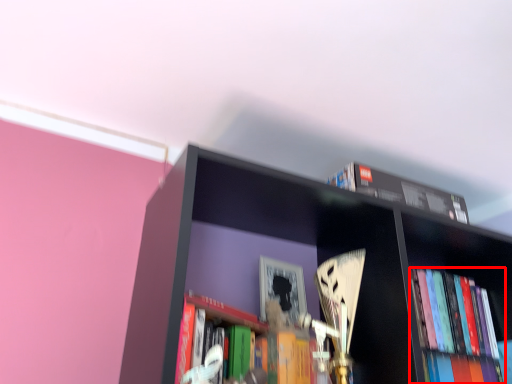
Question: From the image's perspective, considering the relative positions of book (annotated by the red box) and book in the image provided, where is book (annotated by the red box) located with respect to the staircase?

Choices:
 (A) below
 (B) above

Answer: (A)